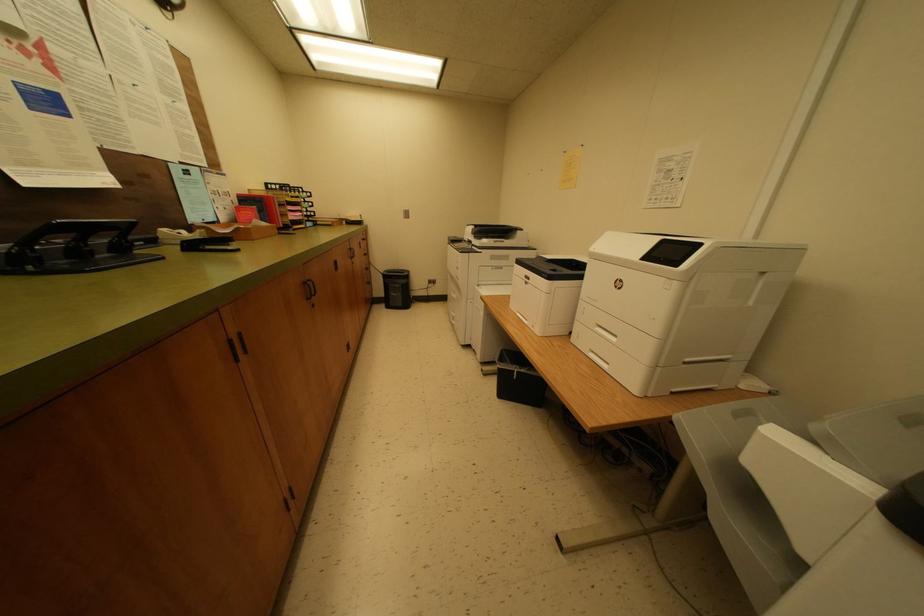
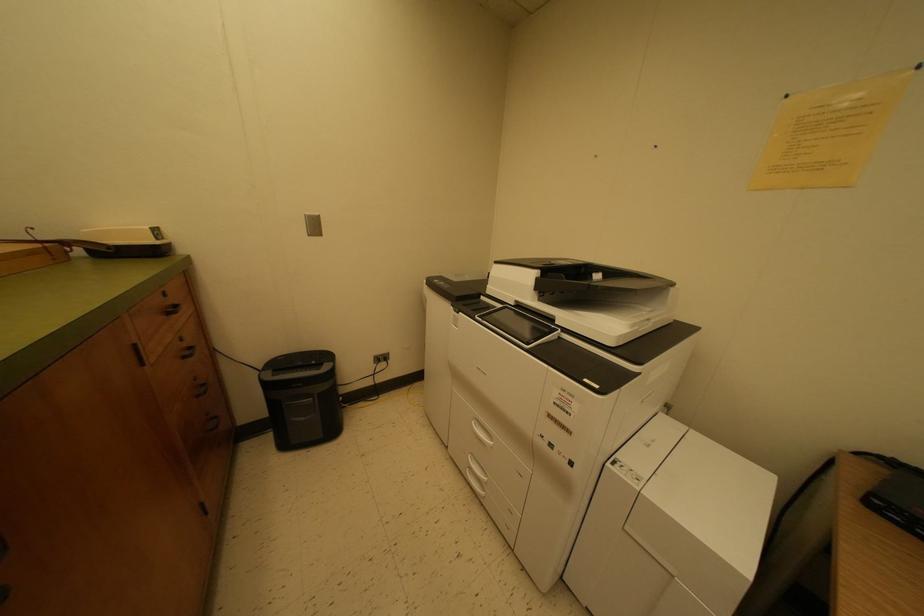
Question: In a continuous first-person perspective shot, in which direction is the camera moving?

Choices:
 (A) Left
 (B) Right
 (C) Forward
 (D) Backward

Answer: (C)